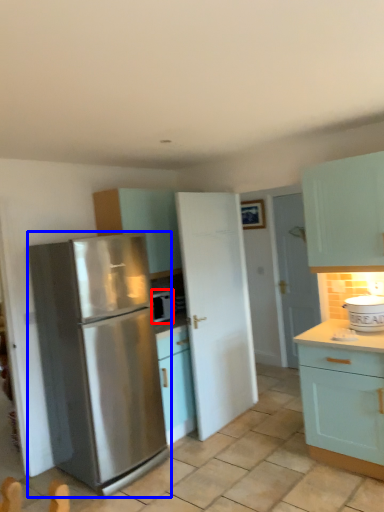
Question: Among these objects, which one is nearest to the camera, appliance (highlighted by a red box) or refrigerator (highlighted by a blue box)?

Choices:
 (A) appliance
 (B) refrigerator

Answer: (B)